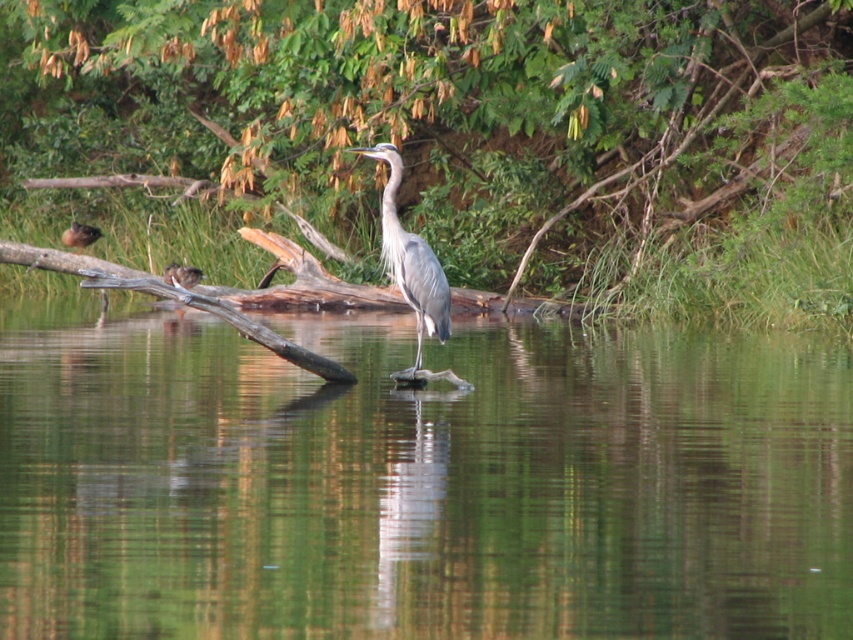
Who is higher up, clear water at center or gray feathered heron at center?

gray feathered heron at center is higher up.

Can you confirm if clear water at center is positioned below gray feathered heron at center?

Correct, clear water at center is located below gray feathered heron at center.

Does point (485, 371) come farther from viewer compared to point (422, 317)?

Yes, point (485, 371) is farther from viewer.

This screenshot has width=853, height=640. Identify the location of clear water at center. (418, 483).

Does green leafy tree at upper center appear on the right side of brown fuzzy duckling at left?

Indeed, green leafy tree at upper center is positioned on the right side of brown fuzzy duckling at left.

Between green leafy tree at upper center and brown fuzzy duckling at left, which one is positioned higher?

green leafy tree at upper center

Where is `green leafy tree at upper center`? green leafy tree at upper center is located at coordinates (422, 106).

Where is `green leafy tree at upper center`? green leafy tree at upper center is located at coordinates (422, 106).

Is green leafy tree at upper center positioned at the back of gray feathered heron at center?

Yes, it is.

Is green leafy tree at upper center to the left of gray feathered heron at center from the viewer's perspective?

Indeed, green leafy tree at upper center is positioned on the left side of gray feathered heron at center.

This screenshot has height=640, width=853. What do you see at coordinates (422, 106) in the screenshot?
I see `green leafy tree at upper center` at bounding box center [422, 106].

Find the location of a particular element. The width and height of the screenshot is (853, 640). green leafy tree at upper center is located at coordinates (422, 106).